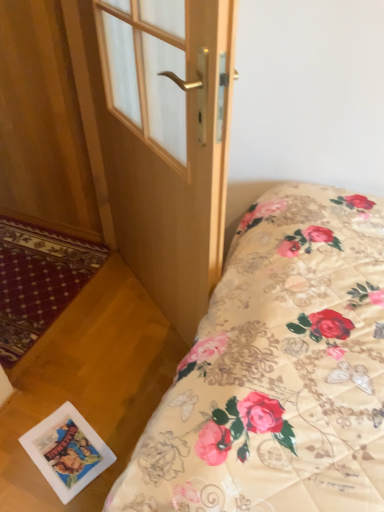
Identify the location of free space above white glossy postcard at lower left (from a real-world perspective). The image size is (384, 512). (91, 445).